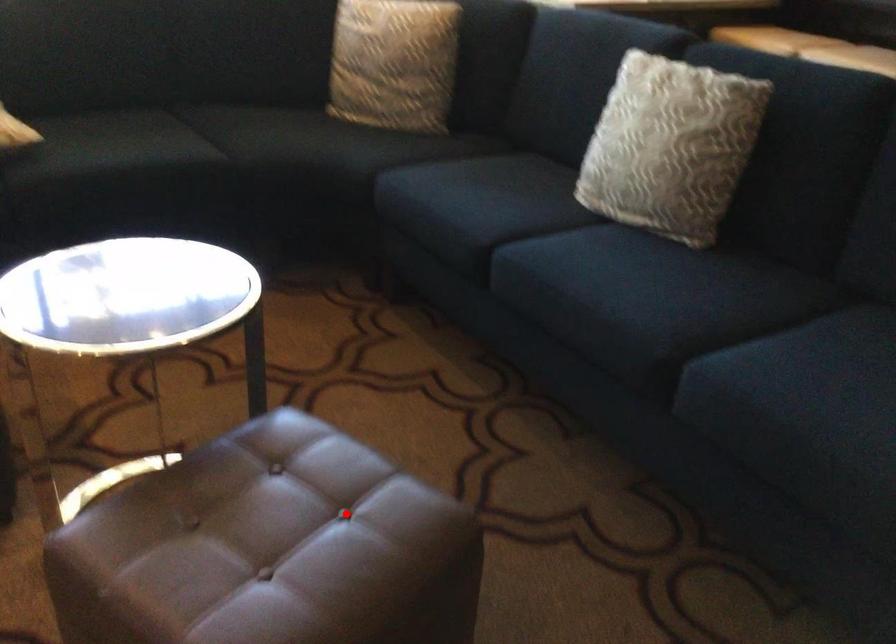
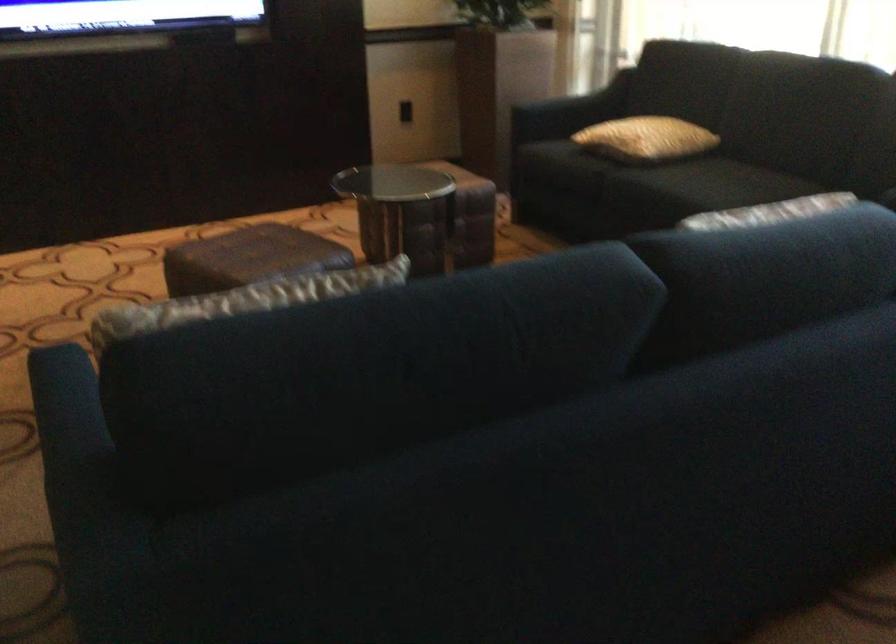
In the second image, find the point that corresponds to the highlighted location in the first image.

(248, 258)